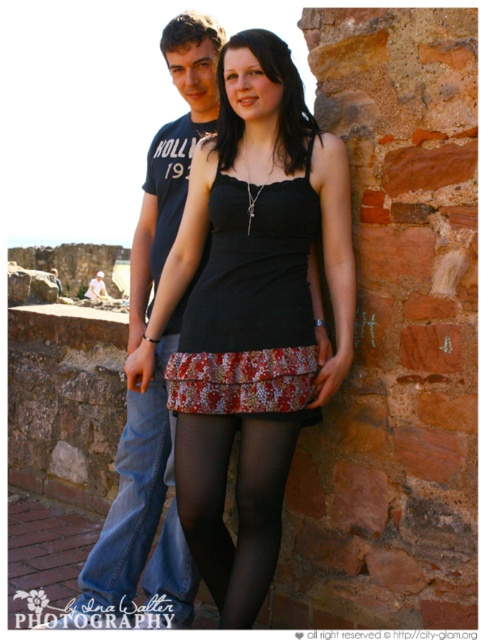
You are a photographer trying to capture both the denim jeans at center and the black sheer tights at center in a single frame. Considering their sizes, which one will appear larger in the photo?

The denim jeans at center will appear larger in the photo because it is much taller than the black sheer tights at center.

You are standing at the base of the stone wall where the two people are standing. You need to place a 3.5 feet wide bench between the denim jeans at center and the denim jeans at left. Will there be enough space?

The denim jeans at center is 5.34 feet away from denim jeans at left. Since the bench is 3.5 feet wide, which is less than the distance between them, there will be enough space to place the bench between the denim jeans at center and the denim jeans at left.